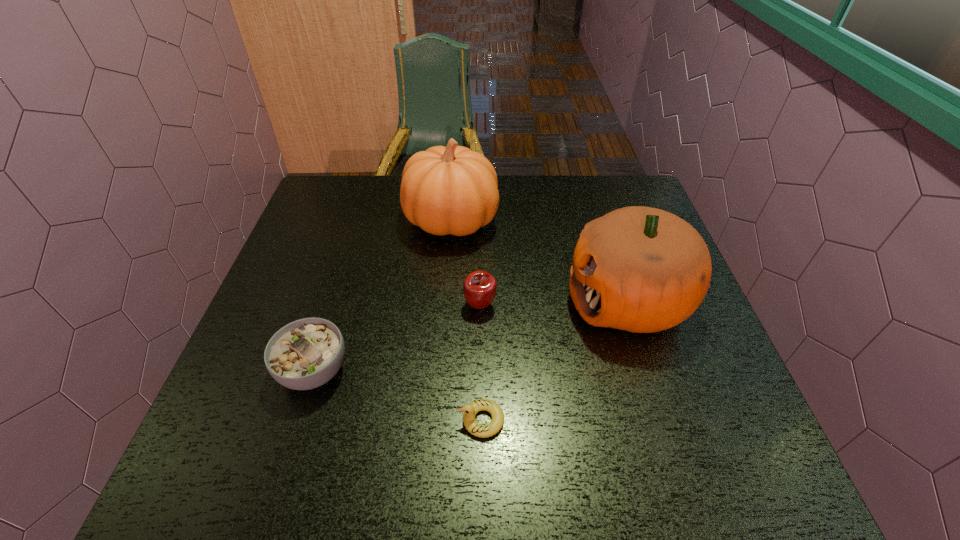
Identify the location of vacant space at the near edge of the desktop. (561, 454).

Find the location of `vacant space at the left edge of the desktop`. vacant space at the left edge of the desktop is located at coordinates (319, 300).

Locate an element on the screen. The width and height of the screenshot is (960, 540). vacant space at the right edge of the desktop is located at coordinates (737, 433).

At what (x,y) coordinates should I click in order to perform the action: click on vacant space at the far left corner of the desktop. Please return your answer as a coordinate pair (x, y). The image size is (960, 540). Looking at the image, I should click on (341, 202).

This screenshot has width=960, height=540. In order to click on free space at the far right corner of the desktop in this screenshot , I will do `click(645, 201)`.

Find the location of a particular element. free region at the near right corner is located at coordinates (746, 445).

The image size is (960, 540). Identify the location of free space between the nearer pumpkin and the apple. pos(554,302).

Where is `vacant space that is in between the leftmost object and the duckling`? Image resolution: width=960 pixels, height=540 pixels. vacant space that is in between the leftmost object and the duckling is located at coordinates (398, 395).

You are a GUI agent. You are given a task and a screenshot of the screen. Output one action in this format:
    pyautogui.click(x=<x>, y=<y>)
    Task: Click on the free space between the left pumpkin and the shortest object
    The width and height of the screenshot is (960, 540).
    Given the screenshot: What is the action you would take?
    pyautogui.click(x=467, y=320)

Locate an element on the screen. free space between the nearer pumpkin and the apple is located at coordinates (554, 302).